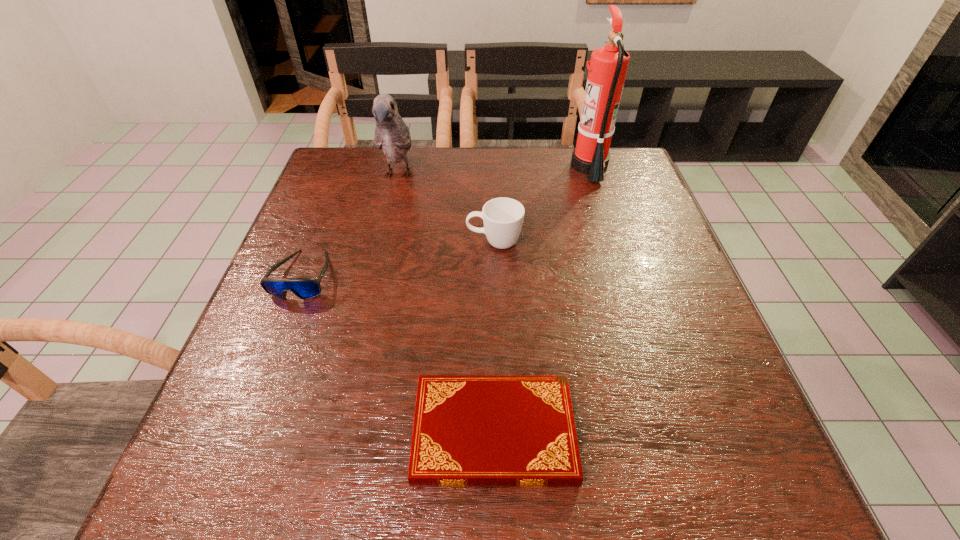
Find the location of a particular element. Image resolution: width=960 pixels, height=540 pixels. free space at the far right corner is located at coordinates (631, 173).

This screenshot has height=540, width=960. Identify the location of free space between the hardback book and the cup. click(x=494, y=338).

The image size is (960, 540). I want to click on free spot between the sunglasses and the nearest object, so click(398, 354).

I want to click on blank region between the cup and the fire extinguisher, so click(x=541, y=205).

Identify the location of free space between the cup and the tallest object. The width and height of the screenshot is (960, 540). (541, 205).

Locate an element on the screen. The height and width of the screenshot is (540, 960). free space between the sunglasses and the parrot is located at coordinates (351, 226).

Image resolution: width=960 pixels, height=540 pixels. In order to click on vacant space that's between the fourth object from right to left and the tallest object in this screenshot , I will do `click(494, 171)`.

What are the coordinates of `free space between the shortest object and the tallest object` in the screenshot? It's located at (541, 300).

The height and width of the screenshot is (540, 960). Identify the location of free space that is in between the nearest object and the cup. (494, 338).

You are a GUI agent. You are given a task and a screenshot of the screen. Output one action in this format:
    pyautogui.click(x=<x>, y=<y>)
    Task: Click on the free space between the shortest object and the fire extinguisher
    Image resolution: width=960 pixels, height=540 pixels.
    Given the screenshot: What is the action you would take?
    pyautogui.click(x=541, y=300)